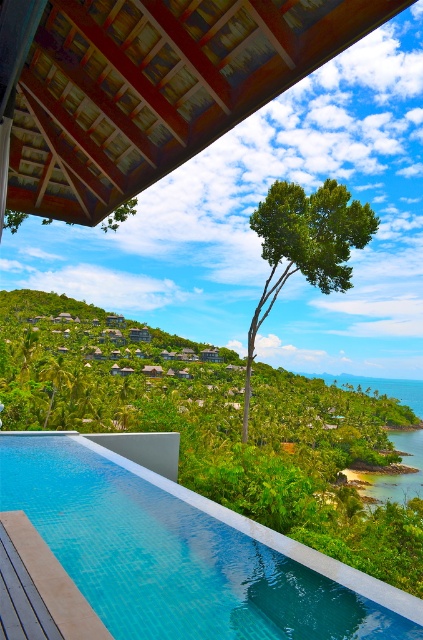
You are standing at the edge of the clear glass pool at center and want to look at the green leafy tree at center. In which direction should you turn your head?

You should turn your head to the right to see the green leafy tree at center because the clear glass pool at center is located to the left of the tree.

You are a visitor at this resort and want to take a photo that includes both the clear glass pool at center and the green leafy tree at center. Based on their heights, which one will appear taller in the photo?

The green leafy tree at center is taller than the clear glass pool at center, so it will appear taller in the photo.